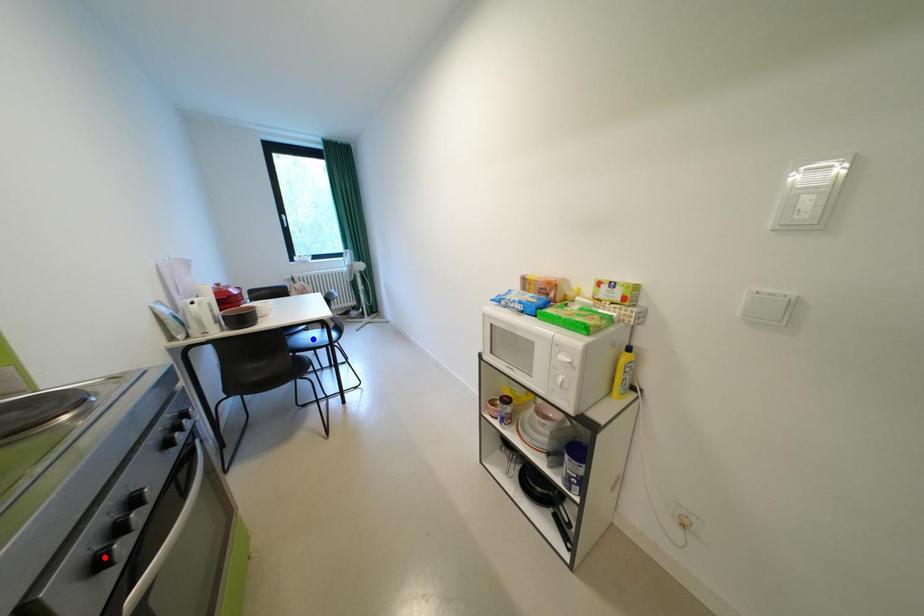
Question: In the image, two points are highlighted. Which point is nearer to the camera? Reply with the corresponding letter.

Choices:
 (A) blue point
 (B) red point

Answer: (B)